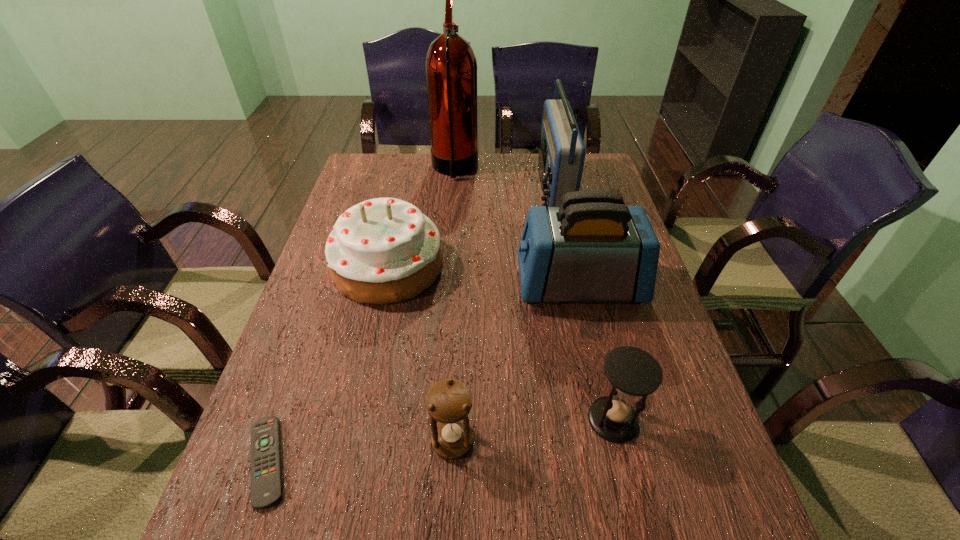
At what (x,y) coordinates should I click in order to perform the action: click on free spot between the tallest object and the toaster. Please return your answer as a coordinate pair (x, y). Looking at the image, I should click on (516, 227).

Where is `vacant area between the toaster and the remote control`? vacant area between the toaster and the remote control is located at coordinates (423, 373).

The height and width of the screenshot is (540, 960). I want to click on empty location between the shortest object and the radio receiver, so click(410, 326).

You are a GUI agent. You are given a task and a screenshot of the screen. Output one action in this format:
    pyautogui.click(x=<x>, y=<y>)
    Task: Click on the free space between the remote control and the toaster
    
    Given the screenshot: What is the action you would take?
    pyautogui.click(x=423, y=373)

The width and height of the screenshot is (960, 540). I want to click on free space between the remote control and the tallest object, so click(361, 315).

Identify the location of unoccupied position between the toaster and the remote control. (423, 373).

At what (x,y) coordinates should I click in order to perform the action: click on vacant space that's between the cake and the left hourglass. Please return your answer as a coordinate pair (x, y). Looking at the image, I should click on (420, 353).

At what (x,y) coordinates should I click in order to perform the action: click on free spot between the right hourglass and the toaster. Please return your answer as a coordinate pair (x, y). Image resolution: width=960 pixels, height=540 pixels. Looking at the image, I should click on (596, 352).

Locate an element on the screen. The width and height of the screenshot is (960, 540). vacant area that lies between the left hourglass and the radio receiver is located at coordinates (502, 316).

Where is `the second closest object to the left hourglass`? The image size is (960, 540). the second closest object to the left hourglass is located at coordinates (266, 476).